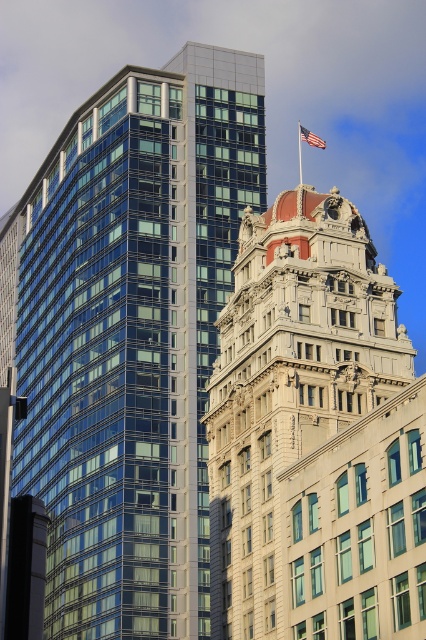
Question: Which object is positioned closest to the white stone tower at center?

Choices:
 (A) american flag at center
 (B) glassy steel skyscraper at left

Answer: (B)

Question: In this image, where is white stone tower at center located relative to american flag at center?

Choices:
 (A) left
 (B) right

Answer: (A)

Question: Among these objects, which one is nearest to the camera?

Choices:
 (A) white stone tower at center
 (B) american flag at center
 (C) glassy steel skyscraper at left

Answer: (A)

Question: Is white stone tower at center in front of american flag at center?

Choices:
 (A) yes
 (B) no

Answer: (A)

Question: Can you confirm if white stone tower at center is positioned to the left of american flag at center?

Choices:
 (A) no
 (B) yes

Answer: (B)

Question: Which point is closer to the camera?

Choices:
 (A) (324, 492)
 (B) (34, 266)
 (C) (310, 134)

Answer: (A)